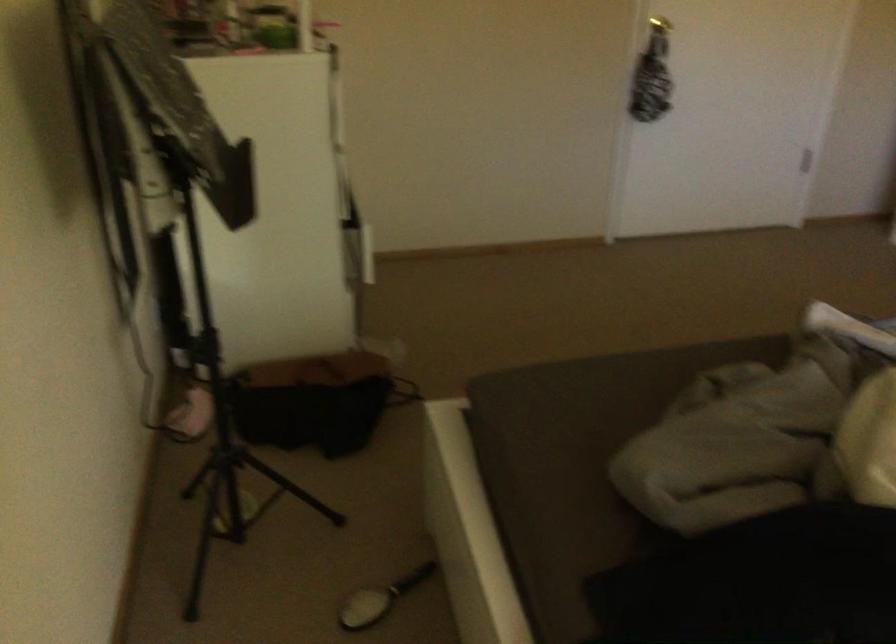
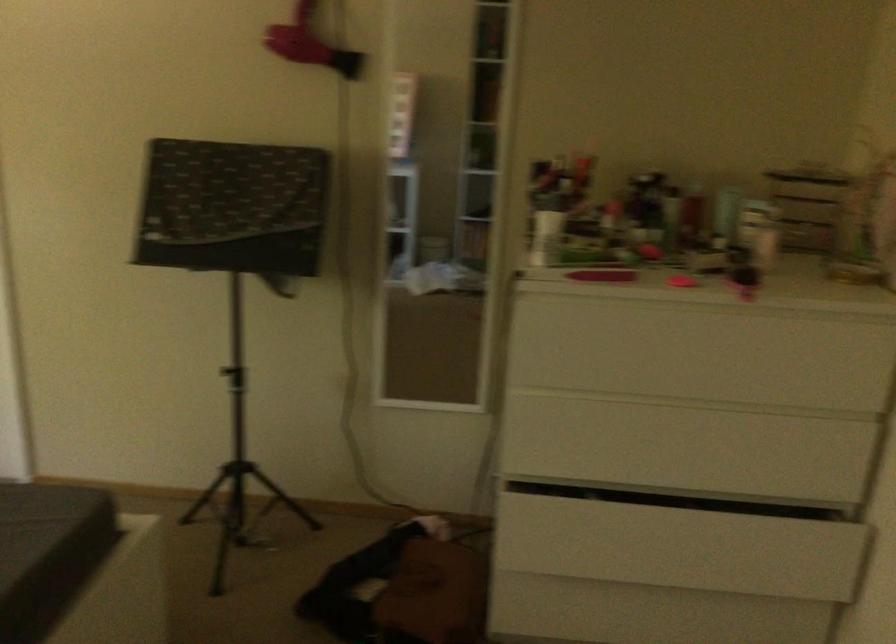
In the second image, find the point that corresponds to [580,390] in the first image.

(38, 523)